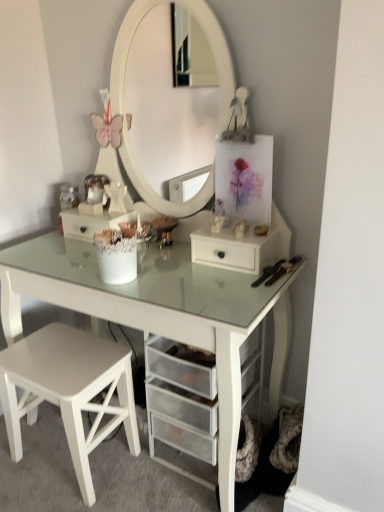
Locate an element on the screen. This screenshot has height=512, width=384. free space above white matte stool at lower left (from a real-world perspective) is located at coordinates (58, 353).